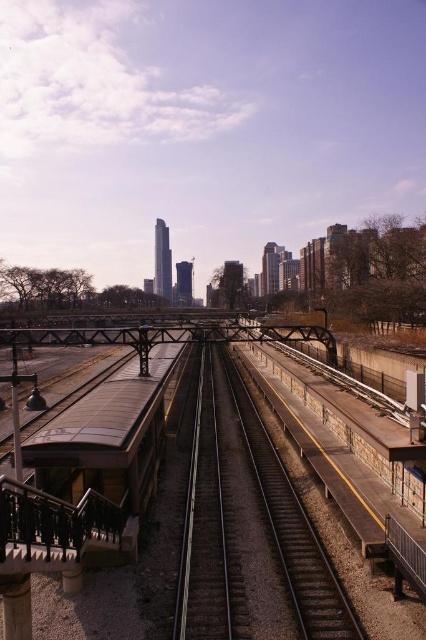
You are a passenger waiting at the concrete platform at center and you see the brown wooden passenger train at left approaching. Can you determine if the train will fit on the platform?

The concrete platform at center has a larger size compared to the brown wooden passenger train at left, so the train will fit on the platform.

You are standing at the train station and see two points marked on the ground. The first point is at coordinates point (327, 595) and the second is at point (176, 372). If you are facing the direction where the tracks converge into the distance, which point is closer to you?

Point (327, 595) is in front of point (176, 372), so it is closer to you when facing the direction where the tracks converge into the distance.